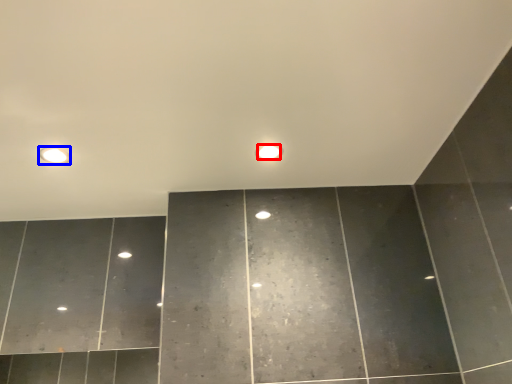
Question: Which point is closer to the camera, light bulb (highlighted by a red box) or fixture (highlighted by a blue box)?

Choices:
 (A) light bulb
 (B) fixture

Answer: (B)